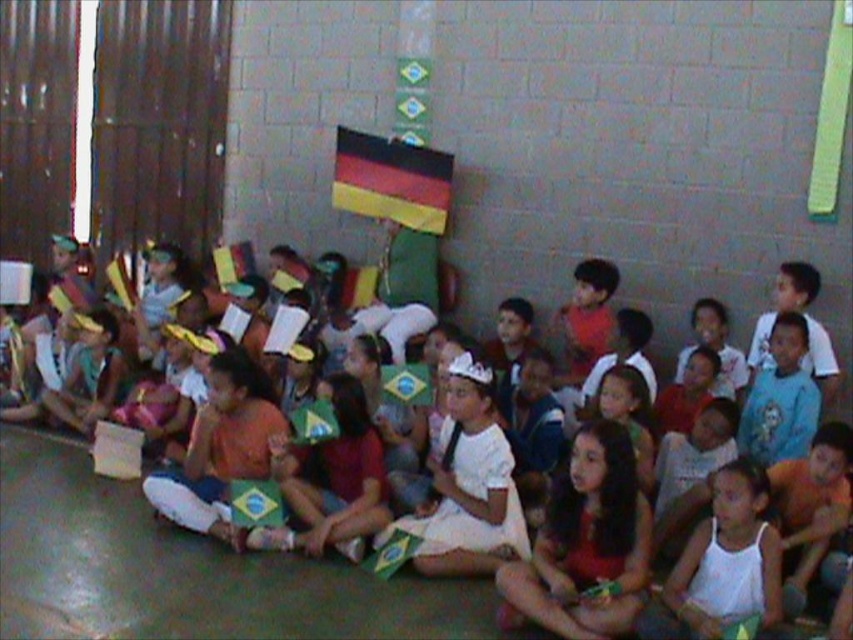
You are a photographer in the classroom and want to take a picture of the white paper hat at center. Where should you position yourself to capture it clearly?

The white paper hat at center is located at point (181, 570), so you should position yourself directly in front of that coordinate to capture it clearly.